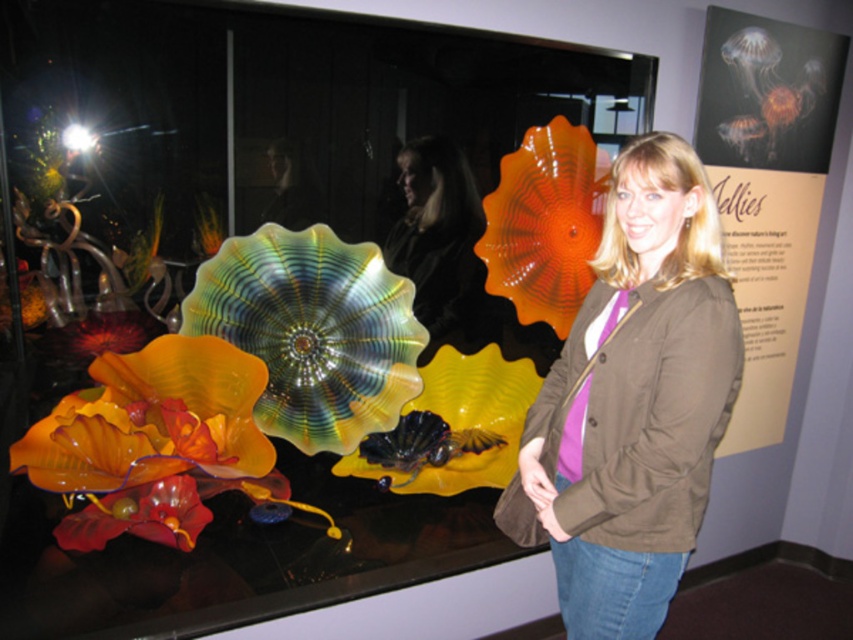
Question: Which of the following is the closest to the observer?

Choices:
 (A) coord(453,252)
 (B) coord(541,301)

Answer: (B)

Question: Which of the following is the closest to the observer?

Choices:
 (A) (399, 161)
 (B) (682, 554)
 (C) (238, 417)
 (D) (556, 237)

Answer: (B)

Question: Is translucent orange glass flower at center wider than matte black jacket at center?

Choices:
 (A) yes
 (B) no

Answer: (A)

Question: Which object is positioned closest to the matte black jacket at center?

Choices:
 (A) translucent orange glass flower at center
 (B) brown fabric jacket at center

Answer: (A)

Question: Does translucent glass flower at lower left have a greater width compared to translucent orange glass flower at center?

Choices:
 (A) yes
 (B) no

Answer: (A)

Question: Can you confirm if brown fabric jacket at center is thinner than translucent orange glass flower at center?

Choices:
 (A) no
 (B) yes

Answer: (A)